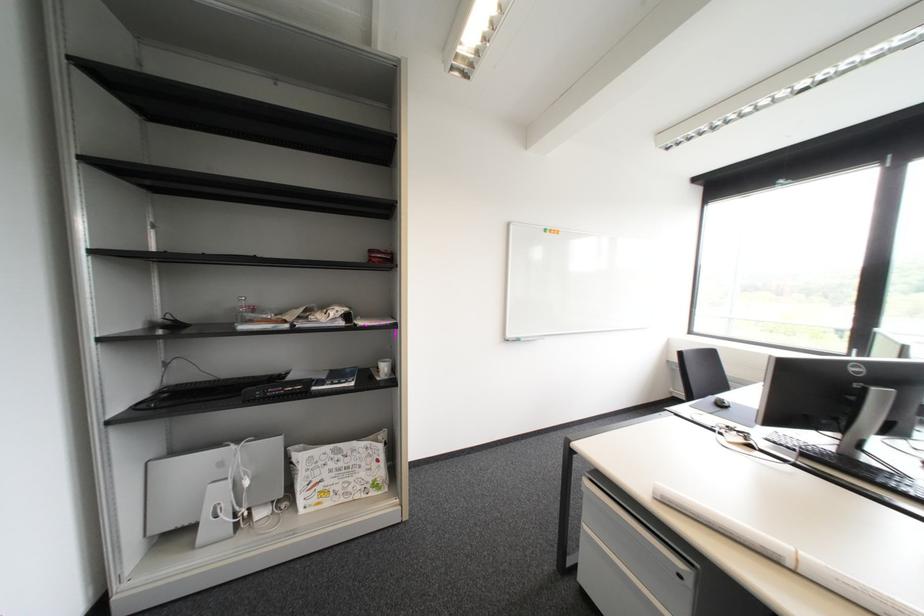
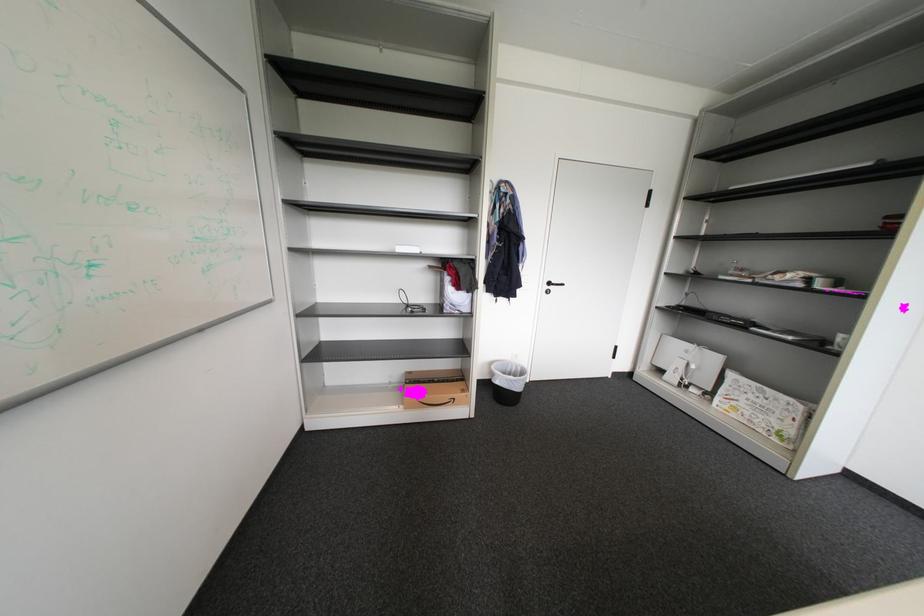
Locate, in the second image, the point that corresponds to pixel 341 472 in the first image.

(758, 400)